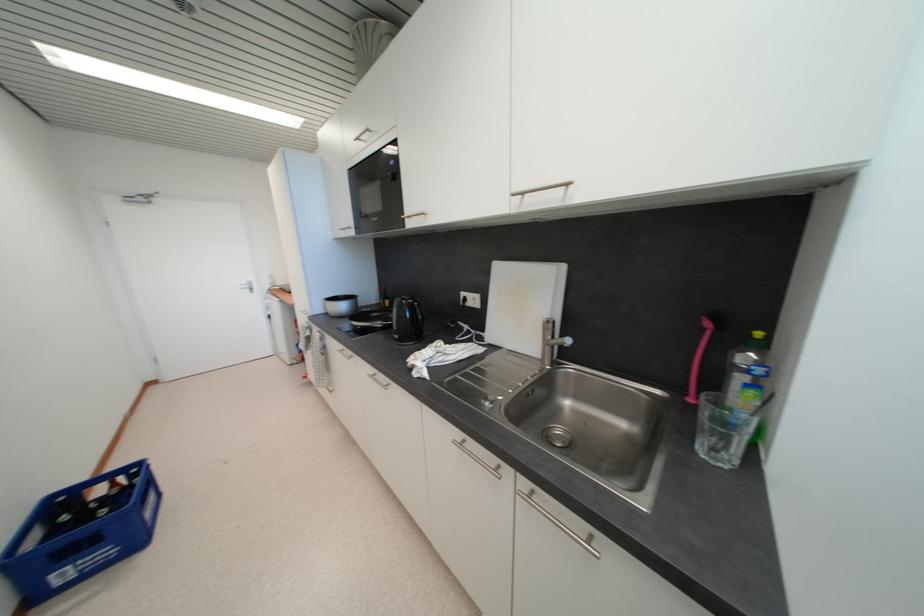
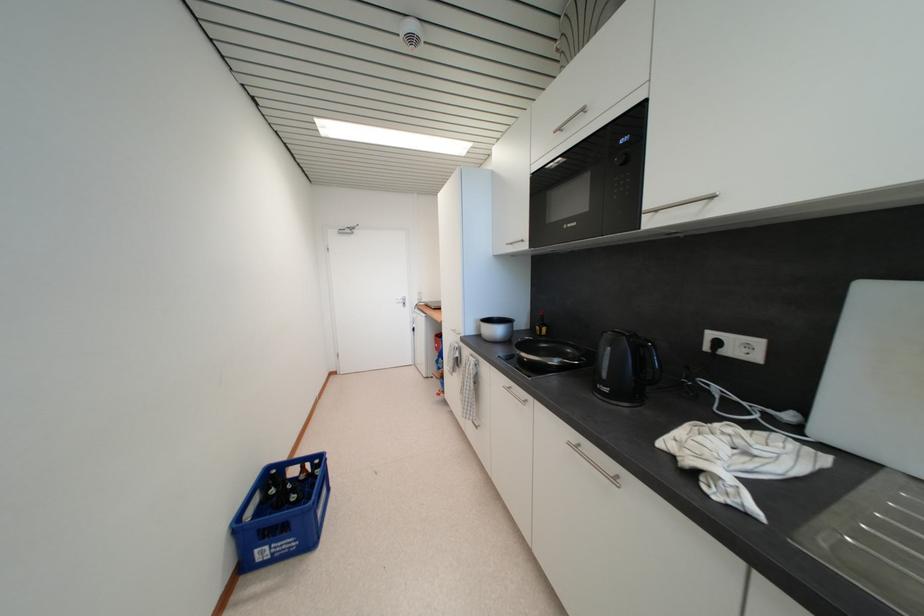
In a continuous first-person perspective shot, in which direction is the camera moving?

The movement direction of the cameraman is left, forward.